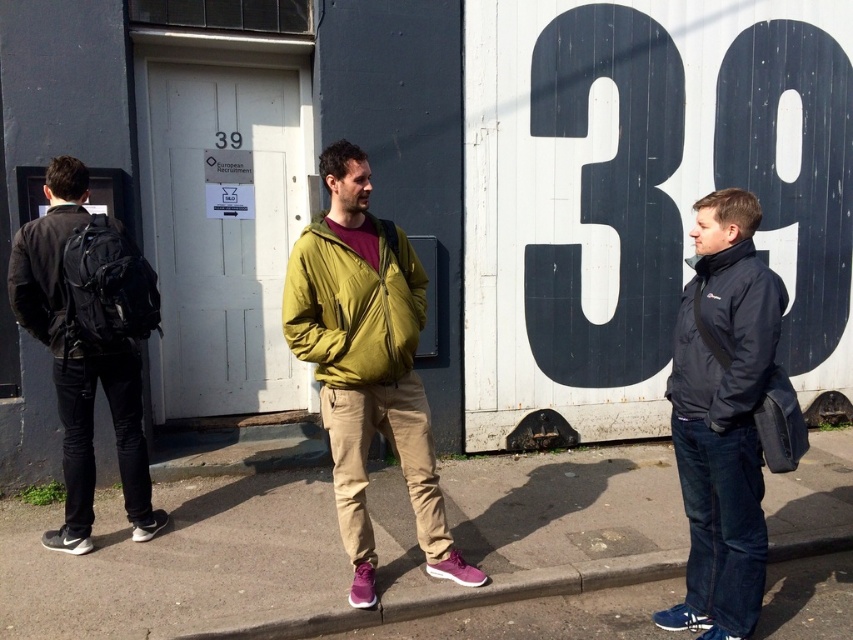
Question: Is gray concrete pavement at lower center positioned behind matte olive green jacket at center?

Choices:
 (A) yes
 (B) no

Answer: (B)

Question: Which object is closer to the camera taking this photo?

Choices:
 (A) black matte backpack at left
 (B) black matte jacket at right
 (C) dark blue jacket at right

Answer: (B)

Question: Does dark blue jacket at right appear over matte olive green jacket at center?

Choices:
 (A) no
 (B) yes

Answer: (A)

Question: Among these objects, which one is nearest to the camera?

Choices:
 (A) gray concrete pavement at lower center
 (B) dark blue jacket at right
 (C) green fabric jacket at center

Answer: (B)

Question: Which of these objects is positioned farthest from the dark blue jacket at right?

Choices:
 (A) black matte jacket at right
 (B) black matte backpack at left

Answer: (B)

Question: Is gray concrete pavement at lower center thinner than black matte backpack at left?

Choices:
 (A) yes
 (B) no

Answer: (B)